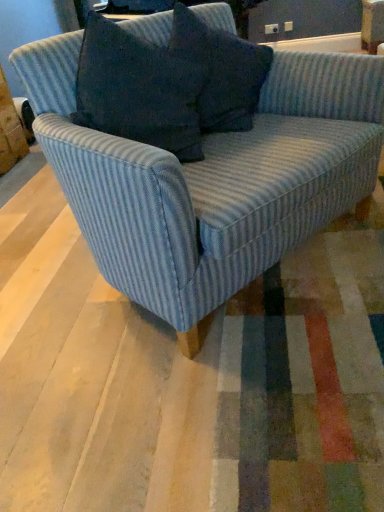
Question: Is blue textured pillow at upper center positioned before blue striped fabric couch at center?

Choices:
 (A) yes
 (B) no

Answer: (B)

Question: Does blue textured pillow at upper center have a greater width compared to blue striped fabric couch at center?

Choices:
 (A) yes
 (B) no

Answer: (B)

Question: Does blue textured pillow at upper center have a smaller size compared to blue striped fabric couch at center?

Choices:
 (A) no
 (B) yes

Answer: (B)

Question: Would you say blue textured pillow at upper center is outside blue striped fabric couch at center?

Choices:
 (A) no
 (B) yes

Answer: (A)

Question: Considering the relative positions of blue textured pillow at upper center and blue striped fabric couch at center in the image provided, is blue textured pillow at upper center behind blue striped fabric couch at center?

Choices:
 (A) yes
 (B) no

Answer: (A)

Question: Is blue textured pillow at upper center not near blue striped fabric couch at center?

Choices:
 (A) yes
 (B) no

Answer: (B)

Question: Is there a large distance between blue striped fabric couch at center and blue textured pillow at upper center?

Choices:
 (A) no
 (B) yes

Answer: (A)

Question: Is blue striped fabric couch at center oriented away from blue textured pillow at upper center?

Choices:
 (A) no
 (B) yes

Answer: (B)

Question: Does blue striped fabric couch at center have a smaller size compared to blue textured pillow at upper center?

Choices:
 (A) yes
 (B) no

Answer: (B)

Question: From a real-world perspective, is blue striped fabric couch at center on top of blue textured pillow at upper center?

Choices:
 (A) no
 (B) yes

Answer: (A)

Question: Could blue textured pillow at upper center be considered to be inside blue striped fabric couch at center?

Choices:
 (A) yes
 (B) no

Answer: (A)

Question: Can you confirm if blue striped fabric couch at center is shorter than blue textured pillow at upper center?

Choices:
 (A) yes
 (B) no

Answer: (B)

Question: From the image's perspective, is blue striped fabric couch at center positioned above or below blue textured pillow at upper center?

Choices:
 (A) below
 (B) above

Answer: (A)